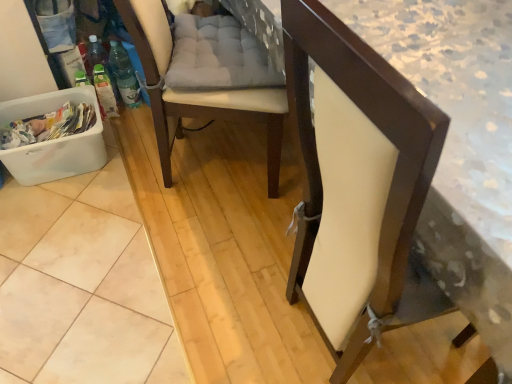
The image size is (512, 384). In order to click on vacant space that's between matte white chair at center, the 2th chair in the left-to-right sequence, and white plastic laundry basket at lower left in this screenshot , I will do `click(163, 239)`.